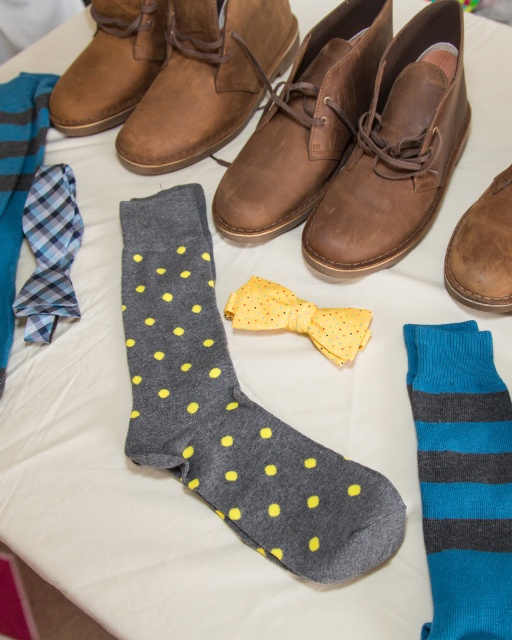
You are standing at the edge of the white surface where the accessories are arranged. You want to reach the point marked as point (x=480, y=634) first and then the point marked as point (x=482, y=220). Which path would require you to move forward first and then backward?

To reach point (x=480, y=634) first and then point (x=482, y=220), you would first move forward to the point (x=480, y=634) since it is in front, then move backward to reach point (x=482, y=220) which is behind it.

You are organizing a display of men fashion accessories and see the brown suede boot at upper center and the brown suede boot at upper left. Which boot is located to the right of the other?

The brown suede boot at upper center is positioned on the right side of brown suede boot at upper left.